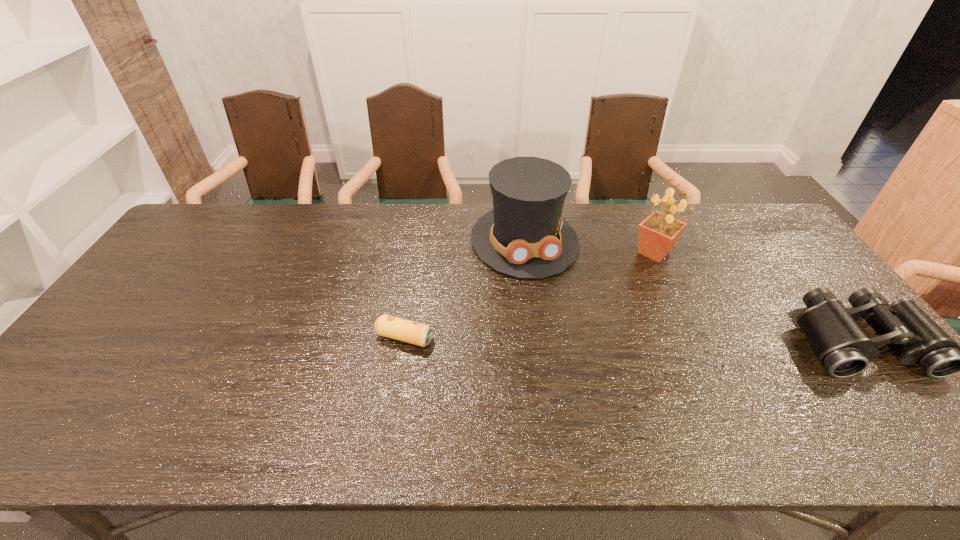
Where is `free location located with goggles on the front of the dress hat`? free location located with goggles on the front of the dress hat is located at coordinates (589, 394).

Where is `vacant space located at the front of the second object from right to left with flowers visible`? This screenshot has width=960, height=540. vacant space located at the front of the second object from right to left with flowers visible is located at coordinates (681, 305).

Find the location of `blank space located at the front of the second object from right to left with flowers visible`. blank space located at the front of the second object from right to left with flowers visible is located at coordinates (673, 291).

Identify the location of free space located 0.200m at the front of the second object from right to left with flowers visible. The width and height of the screenshot is (960, 540). (686, 316).

Where is `dress hat that is positioned at the far edge`? dress hat that is positioned at the far edge is located at coordinates (524, 236).

The height and width of the screenshot is (540, 960). Identify the location of sunflower situated at the far edge. (658, 233).

Where is `object present at the near edge`? object present at the near edge is located at coordinates (841, 345).

Identify the location of object situated at the right edge. This screenshot has width=960, height=540. [841, 345].

What are the coordinates of `object that is positioned at the near right corner` in the screenshot? It's located at (841, 345).

Find the location of a particular element. Image resolution: width=960 pixels, height=540 pixels. vacant space at the far edge is located at coordinates (269, 204).